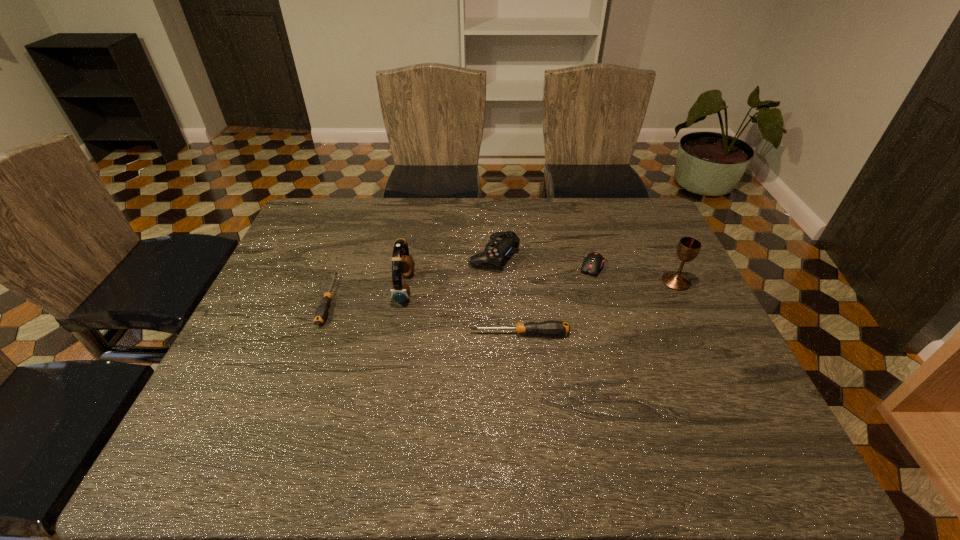
The height and width of the screenshot is (540, 960). Find the location of `free space located on the front of the control`. free space located on the front of the control is located at coordinates (495, 286).

Image resolution: width=960 pixels, height=540 pixels. Identify the location of free location located on the ear cup of the fifth object from right to left. [478, 288].

What are the coordinates of `vacant space positioned 0.050m on the right of the fifth object from left to right` in the screenshot? It's located at [x=621, y=267].

Where is `object located in the far edge section of the desktop`? The height and width of the screenshot is (540, 960). object located in the far edge section of the desktop is located at coordinates (501, 243).

Where is `object that is at the right edge`? object that is at the right edge is located at coordinates (688, 248).

You are a GUI agent. You are given a task and a screenshot of the screen. Output one action in this format:
    pyautogui.click(x=<x>, y=<y>)
    Task: Click on the vacant region at the far edge
    
    Given the screenshot: What is the action you would take?
    pyautogui.click(x=384, y=206)

In the image, there is a desktop. What are the coordinates of `vacant region at the near edge` in the screenshot? It's located at click(x=448, y=418).

Identify the location of free spot at the left edge of the desktop. Image resolution: width=960 pixels, height=540 pixels. (298, 293).

The width and height of the screenshot is (960, 540). In the image, there is a desktop. What are the coordinates of `vacant space at the right edge` in the screenshot? It's located at (655, 263).

The height and width of the screenshot is (540, 960). What are the coordinates of `vacant space at the near right corner of the desktop` in the screenshot? It's located at (679, 387).